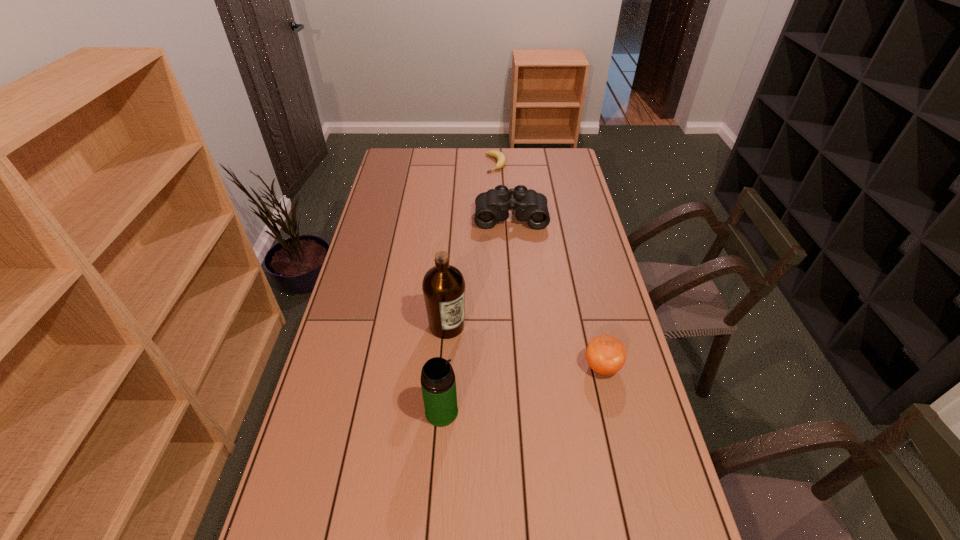
At what (x,y) coordinates should I click in order to perform the action: click on vacant space situated on the back of the fourth farthest object. Please return your answer as a coordinate pair (x, y). This screenshot has height=540, width=960. Looking at the image, I should click on (587, 303).

Image resolution: width=960 pixels, height=540 pixels. I want to click on free space located 0.200m on the label of the tallest object, so click(x=493, y=386).

Locate an element on the screen. blank space located 0.310m on the label of the tallest object is located at coordinates (517, 415).

Where is `vacant space situated on the label of the tallest object`? This screenshot has width=960, height=540. vacant space situated on the label of the tallest object is located at coordinates (488, 378).

The height and width of the screenshot is (540, 960). In order to click on free space located at the stem of the shortest object in this screenshot , I will do `click(503, 200)`.

You are a GUI agent. You are given a task and a screenshot of the screen. Output one action in this format:
    pyautogui.click(x=<x>, y=<y>)
    Task: Click on the vacant point located at the stem of the shortest object
    The height and width of the screenshot is (540, 960).
    Given the screenshot: What is the action you would take?
    pyautogui.click(x=506, y=211)

The width and height of the screenshot is (960, 540). I want to click on blank space located at the stem of the shortest object, so click(x=500, y=187).

The width and height of the screenshot is (960, 540). I want to click on free point located at the eyepieces of the second farthest object, so click(512, 241).

You are a GUI agent. You are given a task and a screenshot of the screen. Output one action in this format:
    pyautogui.click(x=<x>, y=<y>)
    Task: Click on the vacant space located 0.080m at the eyepieces of the second farthest object
    The height and width of the screenshot is (540, 960).
    Given the screenshot: What is the action you would take?
    (512, 243)

Locate an element on the screen. Image resolution: width=960 pixels, height=540 pixels. vacant region located 0.190m at the eyepieces of the second farthest object is located at coordinates (513, 262).